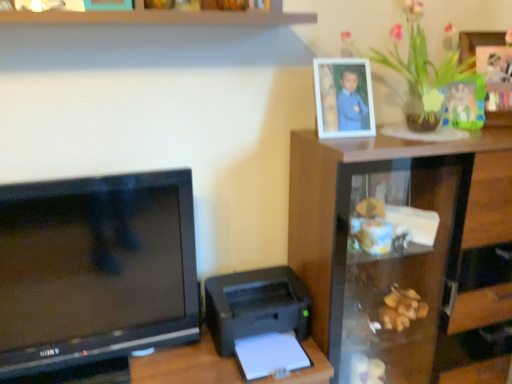
Question: Is green leafy plant at upper right facing towards black plastic printer at lower right?

Choices:
 (A) no
 (B) yes

Answer: (A)

Question: From the image's perspective, is green leafy plant at upper right beneath black plastic printer at lower right?

Choices:
 (A) no
 (B) yes

Answer: (A)

Question: From a real-world perspective, is green leafy plant at upper right physically below black plastic printer at lower right?

Choices:
 (A) yes
 (B) no

Answer: (B)

Question: Is green leafy plant at upper right directly adjacent to black plastic printer at lower right?

Choices:
 (A) yes
 (B) no

Answer: (B)

Question: From a real-world perspective, is green leafy plant at upper right positioned over black plastic printer at lower right based on gravity?

Choices:
 (A) yes
 (B) no

Answer: (A)

Question: In terms of height, does black plastic printer at lower right look taller or shorter compared to green leafy plant at upper right?

Choices:
 (A) tall
 (B) short

Answer: (B)

Question: Is black plastic printer at lower right wider or thinner than green leafy plant at upper right?

Choices:
 (A) thin
 (B) wide

Answer: (A)

Question: Based on their sizes in the image, would you say black plastic printer at lower right is bigger or smaller than green leafy plant at upper right?

Choices:
 (A) small
 (B) big

Answer: (A)

Question: Is black plastic printer at lower right inside or outside of green leafy plant at upper right?

Choices:
 (A) outside
 (B) inside

Answer: (A)

Question: From their relative heights in the image, would you say transparent glass cabinet at upper right is taller or shorter than black plastic printer at lower right?

Choices:
 (A) tall
 (B) short

Answer: (A)

Question: Considering the positions of point (473, 382) and point (238, 311), is point (473, 382) closer or farther from the camera than point (238, 311)?

Choices:
 (A) farther
 (B) closer

Answer: (A)

Question: From the image's perspective, is transparent glass cabinet at upper right positioned above or below black plastic printer at lower right?

Choices:
 (A) below
 (B) above

Answer: (B)

Question: Is transparent glass cabinet at upper right bigger or smaller than black plastic printer at lower right?

Choices:
 (A) small
 (B) big

Answer: (B)

Question: Considering the positions of black plastic printer at lower right and transparent glass cabinet at upper right in the image, is black plastic printer at lower right wider or thinner than transparent glass cabinet at upper right?

Choices:
 (A) wide
 (B) thin

Answer: (B)

Question: Does point (211, 307) appear closer or farther from the camera than point (372, 314)?

Choices:
 (A) closer
 (B) farther

Answer: (A)